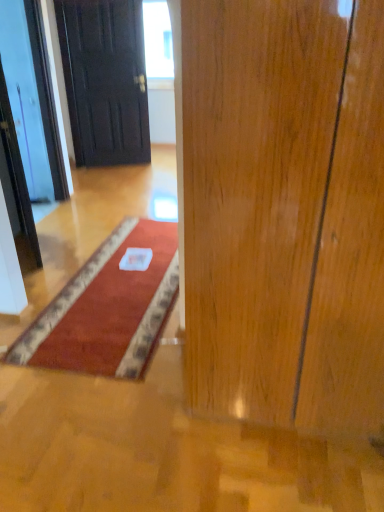
Measure the distance between matte black door at upper left and camera.

They are 4.46 meters apart.

At what (x,y) coordinates should I click in order to perform the action: click on matte black door at upper left. Please return your answer as a coordinate pair (x, y). Looking at the image, I should click on (105, 80).

Describe the element at coordinates (105, 80) in the screenshot. The image size is (384, 512). I see `matte black door at upper left` at that location.

In order to face matte black door at upper left, should I rotate leftwards or rightwards?

Turn left approximately 10.482 degrees to face it.

What is the approximate width of matte black door at upper left?

matte black door at upper left is 10.85 centimeters wide.

What are the coordinates of `matte black door at upper left` in the screenshot? It's located at (105, 80).